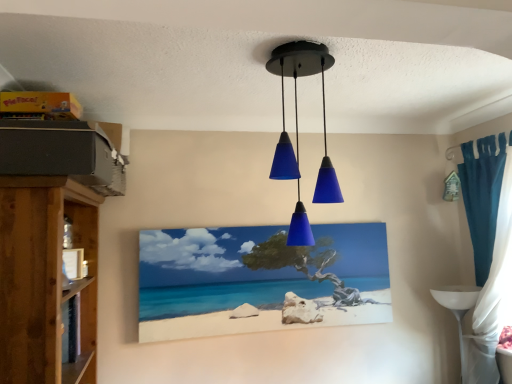
Question: Considering the relative sizes of teal fabric curtain at right and matte blue glass pendant lights at center in the image provided, is teal fabric curtain at right wider than matte blue glass pendant lights at center?

Choices:
 (A) no
 (B) yes

Answer: (A)

Question: Can you confirm if teal fabric curtain at right is bigger than matte blue glass pendant lights at center?

Choices:
 (A) no
 (B) yes

Answer: (B)

Question: Does teal fabric curtain at right have a lesser height compared to matte blue glass pendant lights at center?

Choices:
 (A) yes
 (B) no

Answer: (B)

Question: Is teal fabric curtain at right oriented towards matte blue glass pendant lights at center?

Choices:
 (A) yes
 (B) no

Answer: (A)

Question: Does teal fabric curtain at right appear on the left side of matte blue glass pendant lights at center?

Choices:
 (A) no
 (B) yes

Answer: (A)

Question: Choose the correct answer: Is matte blue glass pendant lights at center inside wooden shelf at left or outside it?

Choices:
 (A) outside
 (B) inside

Answer: (A)

Question: Considering the relative positions of matte blue glass pendant lights at center and wooden shelf at left in the image provided, is matte blue glass pendant lights at center to the left or to the right of wooden shelf at left?

Choices:
 (A) right
 (B) left

Answer: (A)

Question: Does point (288, 228) appear closer or farther from the camera than point (95, 193)?

Choices:
 (A) farther
 (B) closer

Answer: (A)

Question: Considering the positions of matte blue glass pendant lights at center and wooden shelf at left in the image, is matte blue glass pendant lights at center wider or thinner than wooden shelf at left?

Choices:
 (A) thin
 (B) wide

Answer: (A)

Question: Based on their sizes in the image, would you say white glossy table at lower right is bigger or smaller than matte blue glass pendant lights at center?

Choices:
 (A) small
 (B) big

Answer: (A)

Question: Do you think white glossy table at lower right is within matte blue glass pendant lights at center, or outside of it?

Choices:
 (A) outside
 (B) inside

Answer: (A)

Question: Is white glossy table at lower right in front of or behind matte blue glass pendant lights at center in the image?

Choices:
 (A) front
 (B) behind

Answer: (B)

Question: Considering the positions of white glossy table at lower right and matte blue glass pendant lights at center in the image, is white glossy table at lower right wider or thinner than matte blue glass pendant lights at center?

Choices:
 (A) wide
 (B) thin

Answer: (B)

Question: Considering the positions of white matte picture frame at left, the first picture frame in the left-to-right sequence, and matte canvas painting at center, which appears as the 1th picture frame when viewed from the right, in the image, is white matte picture frame at left, the first picture frame in the left-to-right sequence, taller or shorter than matte canvas painting at center, which appears as the 1th picture frame when viewed from the right,?

Choices:
 (A) short
 (B) tall

Answer: (A)

Question: Considering the relative positions of white matte picture frame at left, the 1th picture frame in the front-to-back sequence, and matte canvas painting at center, marked as the 1th picture frame in a back-to-front arrangement, in the image provided, is white matte picture frame at left, the 1th picture frame in the front-to-back sequence, to the left or to the right of matte canvas painting at center, marked as the 1th picture frame in a back-to-front arrangement,?

Choices:
 (A) right
 (B) left

Answer: (B)